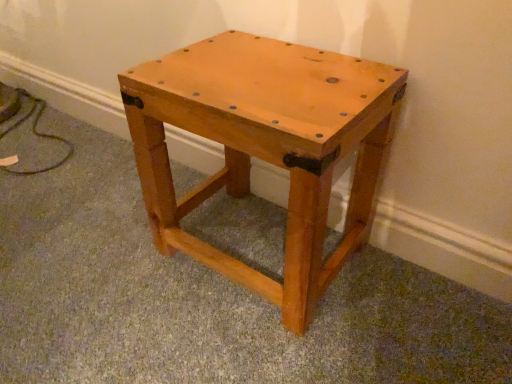
Locate an element on the screen. vacant position to the left of light brown wood stool at center is located at coordinates (99, 258).